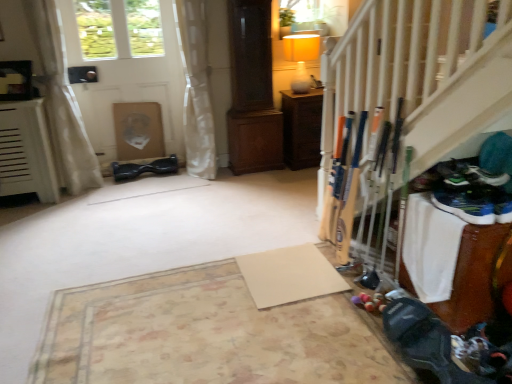
Describe the element at coordinates (62, 102) in the screenshot. I see `white sheer curtain at left, which is the 1th curtain from left to right` at that location.

Where is `wooden cabinet at center`? The height and width of the screenshot is (384, 512). wooden cabinet at center is located at coordinates (302, 128).

At what (x,y) coordinates should I click in order to perform the action: click on beige matte yoga mat at center, positioned as the second yoga mat in right-to-left order. Please return your answer as a coordinate pair (x, y). Image resolution: width=512 pixels, height=384 pixels. Looking at the image, I should click on (207, 334).

Where is `white sheer curtain at upper left, which is the 2th curtain from left to right`? white sheer curtain at upper left, which is the 2th curtain from left to right is located at coordinates (196, 90).

The height and width of the screenshot is (384, 512). What do you see at coordinates (289, 275) in the screenshot? I see `beige matte yoga mat at center, the 1th yoga mat from the right` at bounding box center [289, 275].

You are a GUI agent. You are given a task and a screenshot of the screen. Output one action in this format:
    pyautogui.click(x=<x>, y=<y>)
    Task: Click on the white sheer curtain at left, which is the 1th curtain from left to right
    Image resolution: width=512 pixels, height=384 pixels.
    Given the screenshot: What is the action you would take?
    pyautogui.click(x=62, y=102)

Which is in front, point (267, 297) or point (269, 313)?

Positioned in front is point (269, 313).

Locate an element on the screen. The width and height of the screenshot is (512, 384). yoga mat that appears on the left of beige matte yoga mat at center, the 1th yoga mat from the right is located at coordinates (207, 334).

Considering the positions of objects beige matte yoga mat at center, which is the 2th yoga mat in left-to-right order, and beige matte yoga mat at center, arranged as the 1th yoga mat when viewed from the left, in the image provided, who is more to the right, beige matte yoga mat at center, which is the 2th yoga mat in left-to-right order, or beige matte yoga mat at center, arranged as the 1th yoga mat when viewed from the left,?

Positioned to the right is beige matte yoga mat at center, which is the 2th yoga mat in left-to-right order.

Which object is thinner, white matte door at upper left or beige matte yoga mat at center, which is the 2th yoga mat in left-to-right order?

white matte door at upper left is thinner.

Is point (141, 51) closer to viewer compared to point (300, 255)?

No.

Considering the relative sizes of white matte door at upper left and beige matte yoga mat at center, the 1th yoga mat from the right, in the image provided, is white matte door at upper left shorter than beige matte yoga mat at center, the 1th yoga mat from the right,?

No, white matte door at upper left is not shorter than beige matte yoga mat at center, the 1th yoga mat from the right.

Locate an element on the screen. the 1st yoga mat below when counting from the white matte door at upper left (from the image's perspective) is located at coordinates (289, 275).

You are a GUI agent. You are given a task and a screenshot of the screen. Output one action in this format:
    pyautogui.click(x=<x>, y=<y>)
    Task: Click on the furniture behind the white matte door at upper left
    
    Given the screenshot: What is the action you would take?
    pyautogui.click(x=302, y=128)

Considering the relative positions of white matte door at upper left and wooden cabinet at center in the image provided, is white matte door at upper left in front of wooden cabinet at center?

Yes, it is in front of wooden cabinet at center.

Is white matte door at upper left inside the boundaries of wooden cabinet at center, or outside?

white matte door at upper left is located beyond the bounds of wooden cabinet at center.

Is white matte door at upper left bigger or smaller than wooden cabinet at center?

Clearly, white matte door at upper left is larger in size than wooden cabinet at center.

Is point (300, 295) less distant than point (139, 173)?

Yes.

Can you confirm if beige matte yoga mat at center, the 1th yoga mat from the right, is smaller than black rubber hoverboard at center?

Indeed, beige matte yoga mat at center, the 1th yoga mat from the right, has a smaller size compared to black rubber hoverboard at center.

Between beige matte yoga mat at center, the 1th yoga mat from the right, and black rubber hoverboard at center, which one is positioned in front?

beige matte yoga mat at center, the 1th yoga mat from the right.

Is beige matte yoga mat at center, the 1th yoga mat from the right, far away from black rubber hoverboard at center?

Yes.

From the image's perspective, does white matte door at upper left appear higher than white sheer curtain at left, the second curtain from the right?

Yes, from the image's perspective, white matte door at upper left is on top of white sheer curtain at left, the second curtain from the right.

Considering the sizes of objects white matte door at upper left and white sheer curtain at left, the second curtain from the right, in the image provided, who is wider, white matte door at upper left or white sheer curtain at left, the second curtain from the right,?

white sheer curtain at left, the second curtain from the right, is wider.

From a real-world perspective, is white matte door at upper left positioned above or below white sheer curtain at left, which is the 1th curtain from left to right?

From a real-world perspective, white matte door at upper left is physically above white sheer curtain at left, which is the 1th curtain from left to right.

Which curtain is the 2nd one when counting from the front of the white matte door at upper left? Please provide its 2D coordinates.

[(62, 102)]

From a real-world perspective, between wooden cabinet at center and beige matte yoga mat at center, which is the 2th yoga mat in left-to-right order, who is vertically lower?

beige matte yoga mat at center, which is the 2th yoga mat in left-to-right order, is physically lower.

In terms of height, does wooden cabinet at center look taller or shorter compared to beige matte yoga mat at center, the 1th yoga mat from the right?

Considering their sizes, wooden cabinet at center has more height than beige matte yoga mat at center, the 1th yoga mat from the right.

Is wooden cabinet at center in contact with beige matte yoga mat at center, which is the 2th yoga mat in left-to-right order?

wooden cabinet at center and beige matte yoga mat at center, which is the 2th yoga mat in left-to-right order, are not in contact.

Based on their sizes in the image, would you say wooden cabinet at center is bigger or smaller than beige matte yoga mat at center, which is the 2th yoga mat in left-to-right order?

wooden cabinet at center is bigger than beige matte yoga mat at center, which is the 2th yoga mat in left-to-right order.

From a real-world perspective, is beige matte yoga mat at center, arranged as the 1th yoga mat when viewed from the left, under white sheer curtain at left, the second curtain from the right?

Correct, in the physical world, beige matte yoga mat at center, arranged as the 1th yoga mat when viewed from the left, is lower than white sheer curtain at left, the second curtain from the right.

From the image's perspective, is beige matte yoga mat at center, positioned as the second yoga mat in right-to-left order, located above or below white sheer curtain at left, which is the 1th curtain from left to right?

From the image's perspective, beige matte yoga mat at center, positioned as the second yoga mat in right-to-left order, appears below white sheer curtain at left, which is the 1th curtain from left to right.

Between beige matte yoga mat at center, arranged as the 1th yoga mat when viewed from the left, and white sheer curtain at left, the second curtain from the right, which one appears on the left side from the viewer's perspective?

Positioned to the left is white sheer curtain at left, the second curtain from the right.

From their relative heights in the image, would you say beige matte yoga mat at center, arranged as the 1th yoga mat when viewed from the left, is taller or shorter than white sheer curtain at left, the second curtain from the right?

Clearly, beige matte yoga mat at center, arranged as the 1th yoga mat when viewed from the left, is shorter compared to white sheer curtain at left, the second curtain from the right.

Image resolution: width=512 pixels, height=384 pixels. Identify the location of yoga mat that is on the left side of beige matte yoga mat at center, the 1th yoga mat from the right. (207, 334).

You are a GUI agent. You are given a task and a screenshot of the screen. Output one action in this format:
    pyautogui.click(x=<x>, y=<y>)
    Task: Click on the door lying behind the beige matte yoga mat at center, the 1th yoga mat from the right
    The image size is (512, 384).
    Given the screenshot: What is the action you would take?
    pyautogui.click(x=126, y=66)

Considering their positions, is black rubber hoverboard at center positioned further to wooden cabinet at center than white sheer curtain at left, the second curtain from the right?

Among the two, white sheer curtain at left, the second curtain from the right, is located further to wooden cabinet at center.

When comparing their distances from white sheer curtain at left, which is the 1th curtain from left to right, does white matte door at upper left or wooden cabinet at center seem further?

Based on the image, wooden cabinet at center appears to be further to white sheer curtain at left, which is the 1th curtain from left to right.

When comparing their distances from white sheer curtain at upper left, acting as the first curtain starting from the right, does black rubber hoverboard at center or white sheer curtain at left, the second curtain from the right, seem further?

The object further to white sheer curtain at upper left, acting as the first curtain starting from the right, is white sheer curtain at left, the second curtain from the right.

Based on their spatial positions, is black rubber hoverboard at center or beige matte yoga mat at center, which is the 2th yoga mat in left-to-right order, closer to matte yellow glass lamp at upper center?

black rubber hoverboard at center.

Considering their positions, is white sheer curtain at left, the second curtain from the right, positioned further to white sheer curtain at upper left, which is the 2th curtain from left to right, than matte yellow glass lamp at upper center?

white sheer curtain at left, the second curtain from the right, lies further to white sheer curtain at upper left, which is the 2th curtain from left to right, than the other object.

Based on their spatial positions, is matte yellow glass lamp at upper center or beige matte yoga mat at center, positioned as the second yoga mat in right-to-left order, closer to white sheer curtain at upper left, which is the 2th curtain from left to right?

Among the two, matte yellow glass lamp at upper center is located nearer to white sheer curtain at upper left, which is the 2th curtain from left to right.

Looking at the image, which one is located closer to black rubber hoverboard at center, wooden cabinet at center or beige matte yoga mat at center, the 1th yoga mat from the right?

wooden cabinet at center is positioned closer to the anchor black rubber hoverboard at center.

From the image, which object appears to be nearer to white sheer curtain at left, which is the 1th curtain from left to right, beige matte yoga mat at center, arranged as the 1th yoga mat when viewed from the left, or matte yellow glass lamp at upper center?

matte yellow glass lamp at upper center lies closer to white sheer curtain at left, which is the 1th curtain from left to right, than the other object.

Locate an element on the screen. Image resolution: width=512 pixels, height=384 pixels. door located between beige matte yoga mat at center, positioned as the second yoga mat in right-to-left order, and black rubber hoverboard at center in the depth direction is located at coordinates 126,66.

Locate an element on the screen. shoe situated between white sheer curtain at left, the second curtain from the right, and wooden cabinet at center from left to right is located at coordinates (145, 168).

Identify the location of lamp located between white sheer curtain at upper left, which is the 2th curtain from left to right, and wooden cabinet at center in the left-right direction. (301, 58).

The image size is (512, 384). I want to click on lamp positioned between beige matte yoga mat at center, which is the 2th yoga mat in left-to-right order, and black rubber hoverboard at center from near to far, so click(x=301, y=58).